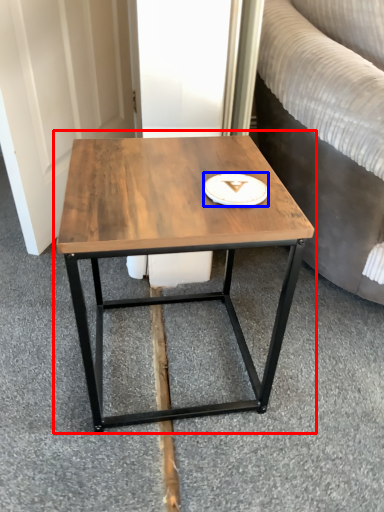
Question: Which object appears farthest to the camera in this image, coffee table (highlighted by a red box) or platter (highlighted by a blue box)?

Choices:
 (A) coffee table
 (B) platter

Answer: (B)